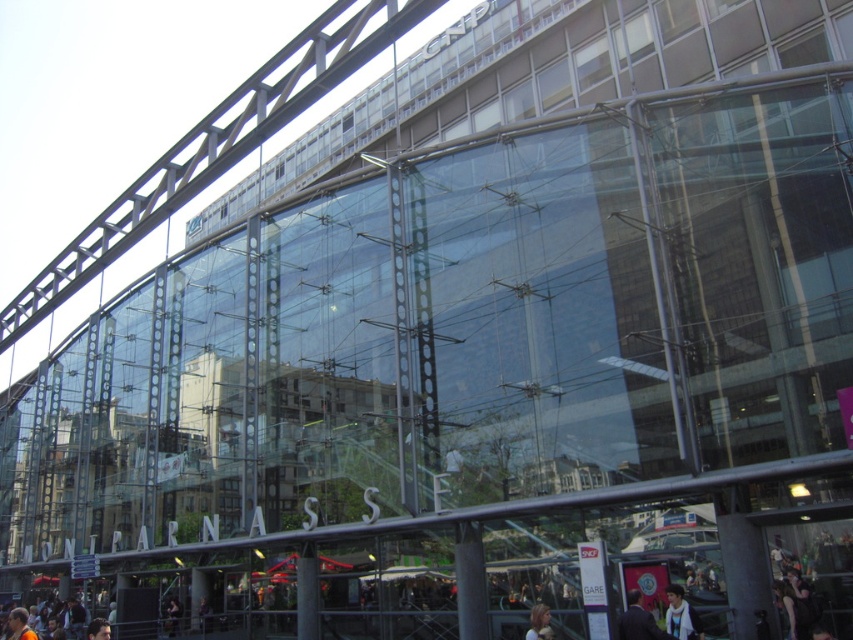
Question: Can you confirm if dark blue suit at lower right is thinner than blue denim jacket at lower right?

Choices:
 (A) no
 (B) yes

Answer: (A)

Question: Which point is closer to the camera?

Choices:
 (A) dark blue suit at lower right
 (B) blonde hair at lower center

Answer: (A)

Question: Can you confirm if blue denim jacket at lower right is thinner than blonde hair at lower center?

Choices:
 (A) no
 (B) yes

Answer: (A)

Question: Among these objects, which one is nearest to the camera?

Choices:
 (A) dark blue suit at lower right
 (B) blonde hair at lower center

Answer: (A)

Question: Which point is farther to the camera?

Choices:
 (A) click(686, 632)
 (B) click(631, 611)

Answer: (B)

Question: Does dark blue suit at lower right have a larger size compared to blue denim jacket at lower right?

Choices:
 (A) yes
 (B) no

Answer: (A)